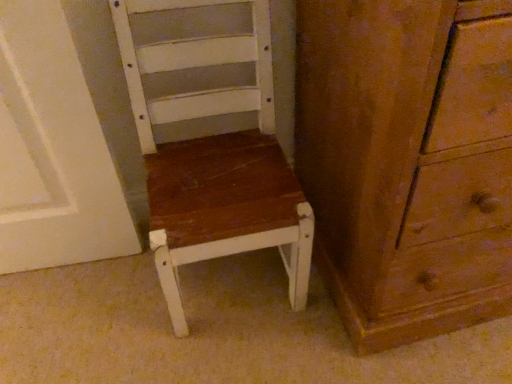
You are a GUI agent. You are given a task and a screenshot of the screen. Output one action in this format:
    pyautogui.click(x=<x>, y=<y>)
    Task: Click on the free region on the left part of white wood chair at center
    The width and height of the screenshot is (512, 384).
    Given the screenshot: What is the action you would take?
    pyautogui.click(x=97, y=299)